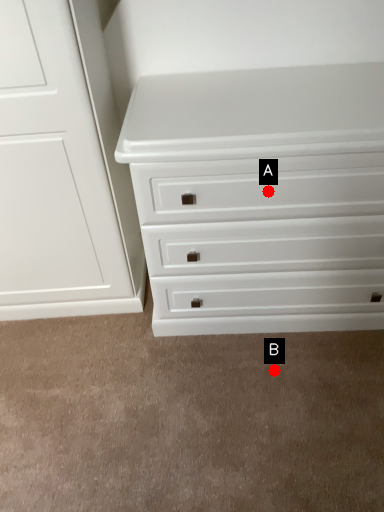
Question: Two points are circled on the image, labeled by A and B beside each circle. Among these points, which one is farthest from the camera?

Choices:
 (A) A is further
 (B) B is further

Answer: (B)